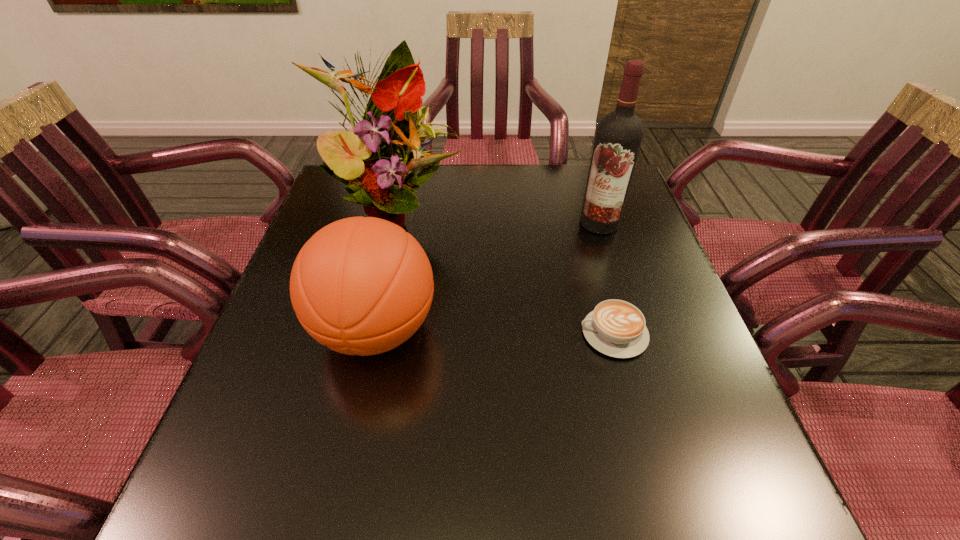
Where is `free space on the desktop that is between the third tallest object and the cappuccino and is positioned on the front-facing side of the bouquet`? free space on the desktop that is between the third tallest object and the cappuccino and is positioned on the front-facing side of the bouquet is located at coordinates (481, 332).

At what (x,y) coordinates should I click in order to perform the action: click on free spot on the desktop that is between the basketball and the cappuccino and is positioned on the label of the wine bottle. Please return your answer as a coordinate pair (x, y). The image size is (960, 540). Looking at the image, I should click on (480, 332).